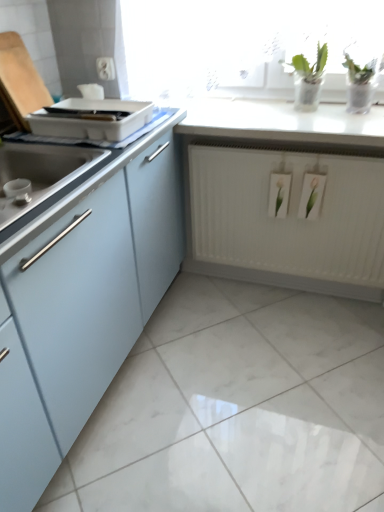
This screenshot has height=512, width=384. What are the coordinates of `free space below white matte radiator at center (from a real-world perspective)` in the screenshot? It's located at (288, 292).